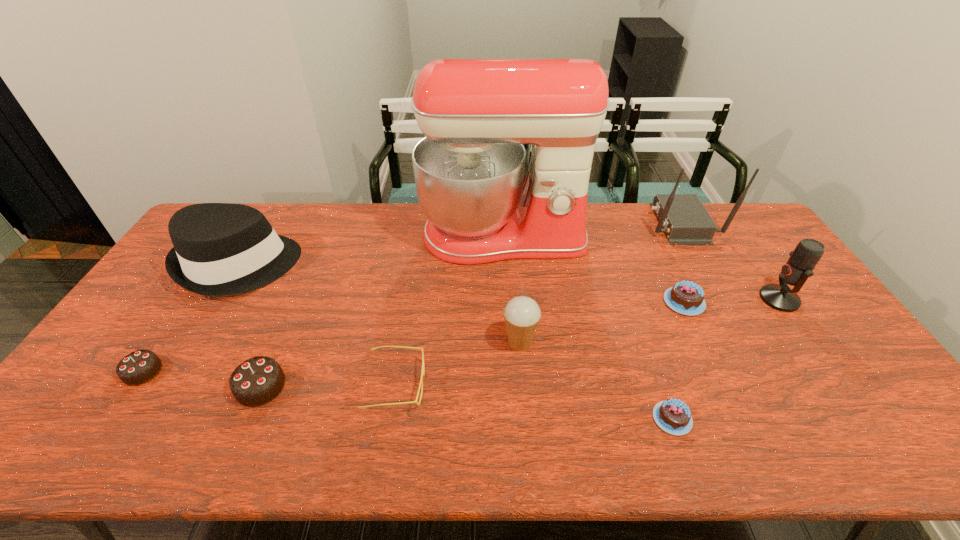
Where is `vacant space located on the side of the microphone with the red ring`? vacant space located on the side of the microphone with the red ring is located at coordinates (674, 299).

I want to click on vacant region located 0.280m on the side of the microphone with the red ring, so click(x=667, y=299).

Where is `vacant space situated 0.090m on the front of the fedora`? vacant space situated 0.090m on the front of the fedora is located at coordinates (202, 326).

Image resolution: width=960 pixels, height=540 pixels. Find the location of `vacant space situated 0.060m on the right of the fifth tallest object`. vacant space situated 0.060m on the right of the fifth tallest object is located at coordinates (560, 343).

Locate an element on the screen. free space located on the right of the right chocolate chocolate cake is located at coordinates (437, 387).

Where is `vacant area located 0.340m on the back of the farthest chocolate cake`? Image resolution: width=960 pixels, height=540 pixels. vacant area located 0.340m on the back of the farthest chocolate cake is located at coordinates (647, 222).

The width and height of the screenshot is (960, 540). What are the coordinates of `free region located 0.150m on the front of the smaller chocolate chocolate cake` in the screenshot? It's located at (95, 444).

Image resolution: width=960 pixels, height=540 pixels. In order to click on vacant space located 0.350m in front of the lenses of the beige spectacles in this screenshot , I will do `click(564, 384)`.

The width and height of the screenshot is (960, 540). What are the coordinates of `vacant area situated 0.390m on the left of the second chocolate cake from right to left` in the screenshot? It's located at (487, 418).

Identify the location of mixer positioned at the far edge. This screenshot has height=540, width=960. (476, 114).